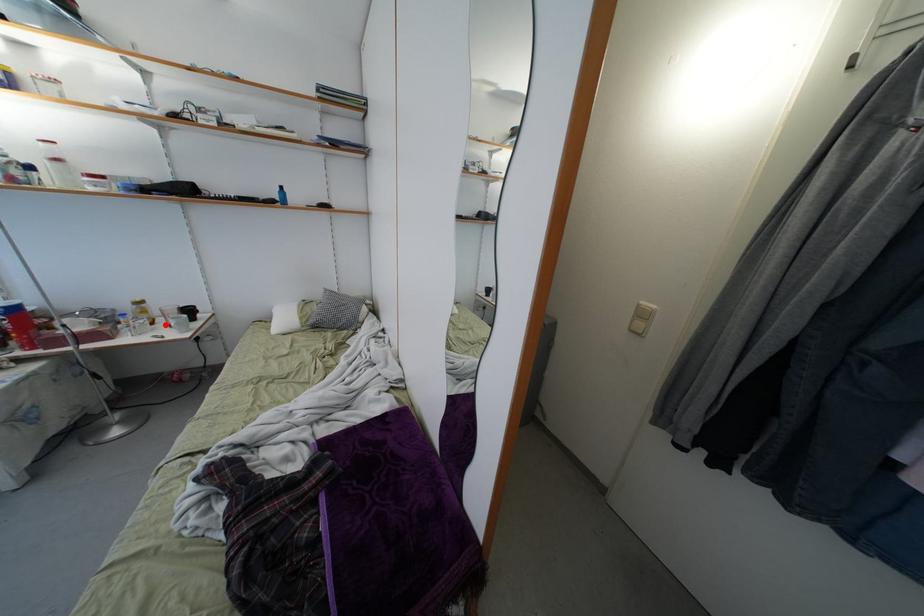
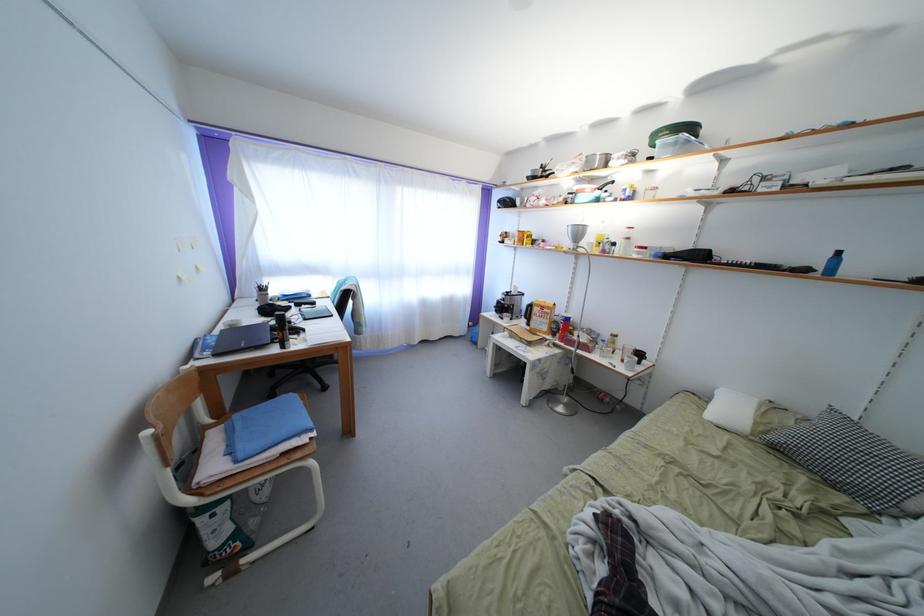
Locate, in the second image, the point that corresponds to the highlighted location in the first image.

(624, 359)